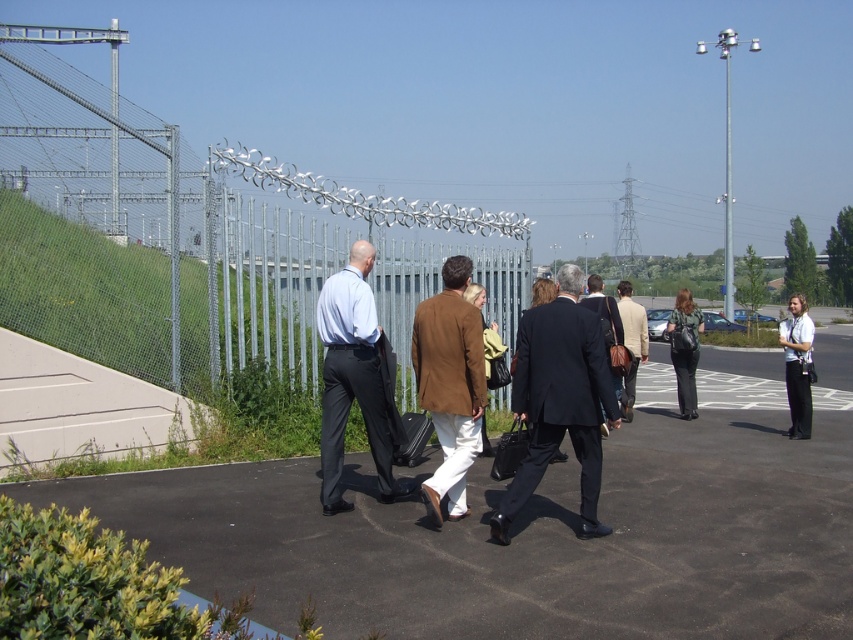
You are a photographer trying to capture a clear shot of the dark blue wool suit at center. Given the coordinates provided, where should you position your camera to ensure the subject is in focus?

To capture the dark blue wool suit at center, position your camera at the coordinates provided, which are point 0.631 on the x and 0.657 on the y axis, to ensure the subject is in focus.

You are standing in the industrial area shown in the image. There are two points marked in the scene. The first point is at coordinates point (x=540, y=323) and the second is at point (x=606, y=348). Which of these two points is closer to your current position?

Point (x=540, y=323) is closer to the camera than point (x=606, y=348), so the first point is closer to your current position.

You are part of the group walking towards the metal gate with barbed wire. You notice two points marked on the ground ahead of you. The first point is at coordinates point (804, 541) and the second is at point (682, 376). Which point is closer to the gate you are approaching?

Point (804, 541) is in front of point (682, 376), so the first point is closer to the gate you are approaching.